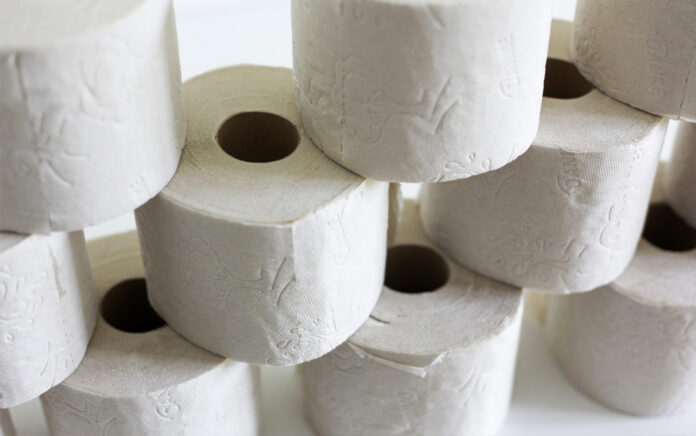
Image resolution: width=696 pixels, height=436 pixels. What are the coordinates of `toilet paper roll` in the screenshot? It's located at point(113,119), point(420,36), point(656,50), point(564,166), point(51,288), point(245,222), point(155,411), point(381,394), point(5,429), point(624,336).